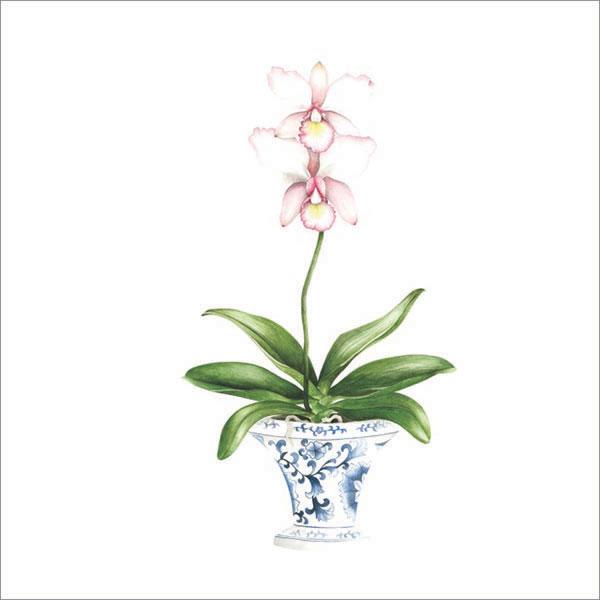
You are a GUI agent. You are given a task and a screenshot of the screen. Output one action in this format:
    pyautogui.click(x=<x>, y=<y>)
    Task: Click on the artwork
    
    Given the screenshot: What is the action you would take?
    pyautogui.click(x=364, y=465)